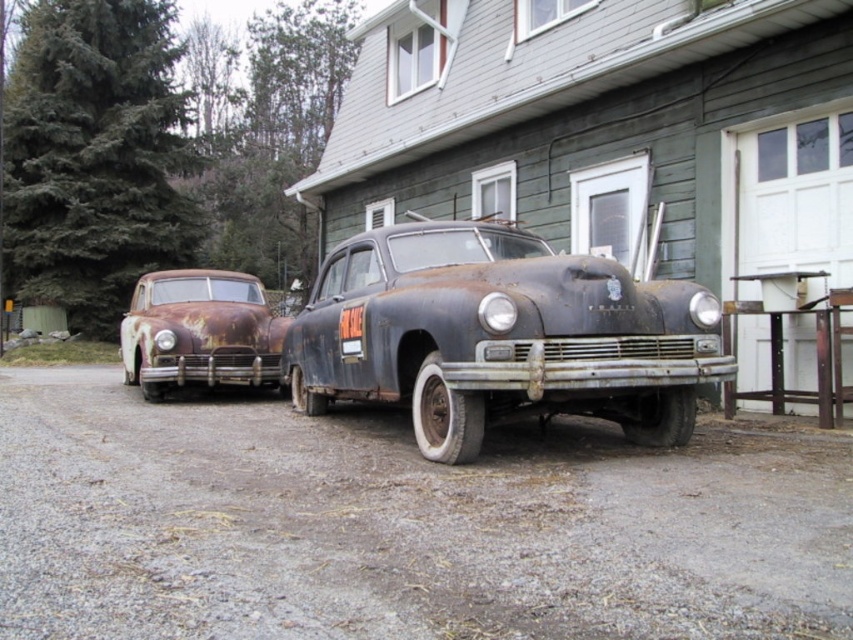
Question: Is rusty gravel driveway at lower center to the right of rusty metal car at center from the viewer's perspective?

Choices:
 (A) yes
 (B) no

Answer: (B)

Question: Which of the following is the closest to the observer?

Choices:
 (A) rusty metal car at center
 (B) rusty gravel driveway at lower center
 (C) rusty metal car at left

Answer: (B)

Question: Which of the following is the closest to the observer?

Choices:
 (A) rusty gravel driveway at lower center
 (B) rusty metal car at left
 (C) rusty metal car at center

Answer: (A)

Question: Which point is closer to the camera taking this photo?

Choices:
 (A) (682, 298)
 (B) (664, 616)
 (C) (119, 340)

Answer: (B)

Question: Is rusty metal car at center below rusty metal car at left?

Choices:
 (A) yes
 (B) no

Answer: (A)

Question: Is rusty gravel driveway at lower center to the left of rusty metal car at center from the viewer's perspective?

Choices:
 (A) yes
 (B) no

Answer: (A)